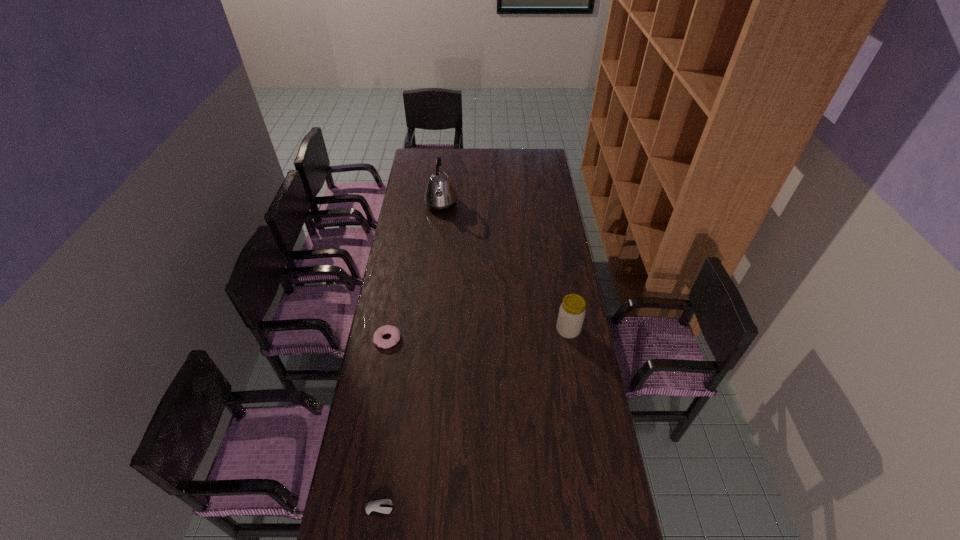
Locate an element on the screen. kettle situated at the left edge is located at coordinates (440, 195).

The height and width of the screenshot is (540, 960). I want to click on doughnut positioned at the left edge, so click(387, 329).

You are a GUI agent. You are given a task and a screenshot of the screen. Output one action in this format:
    pyautogui.click(x=<x>, y=<y>)
    Task: Click on the mouse at the left edge
    
    Given the screenshot: What is the action you would take?
    pyautogui.click(x=382, y=507)

Identify the location of object that is at the right edge. (571, 315).

At what (x,y) coordinates should I click in order to perform the action: click on free space at the left edge of the desktop. Please return your answer as a coordinate pair (x, y). Looking at the image, I should click on pyautogui.click(x=408, y=172).

Where is `vacant space at the right edge of the desktop`? The width and height of the screenshot is (960, 540). vacant space at the right edge of the desktop is located at coordinates (564, 261).

In the image, there is a desktop. Identify the location of vacant space at the far right corner. The height and width of the screenshot is (540, 960). (547, 167).

Where is `vacant region between the nearest object and the third shortest object`? This screenshot has width=960, height=540. vacant region between the nearest object and the third shortest object is located at coordinates (474, 419).

Image resolution: width=960 pixels, height=540 pixels. I want to click on free space between the tallest object and the doughnut, so click(415, 272).

Where is `free spot between the tallest object and the doughnut`? This screenshot has width=960, height=540. free spot between the tallest object and the doughnut is located at coordinates (415, 272).